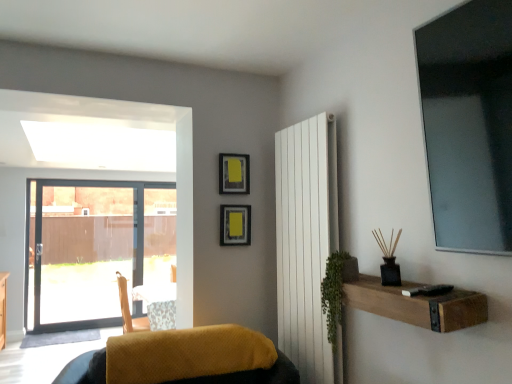
You are a GUI agent. You are given a task and a screenshot of the screen. Output one action in this format:
    pyautogui.click(x=<x>, y=<y>)
    Task: Click on the blank space situated above brown wooden shelf at lower right (from a real-world perspective)
    The image size is (512, 384).
    Given the screenshot: What is the action you would take?
    pyautogui.click(x=401, y=286)